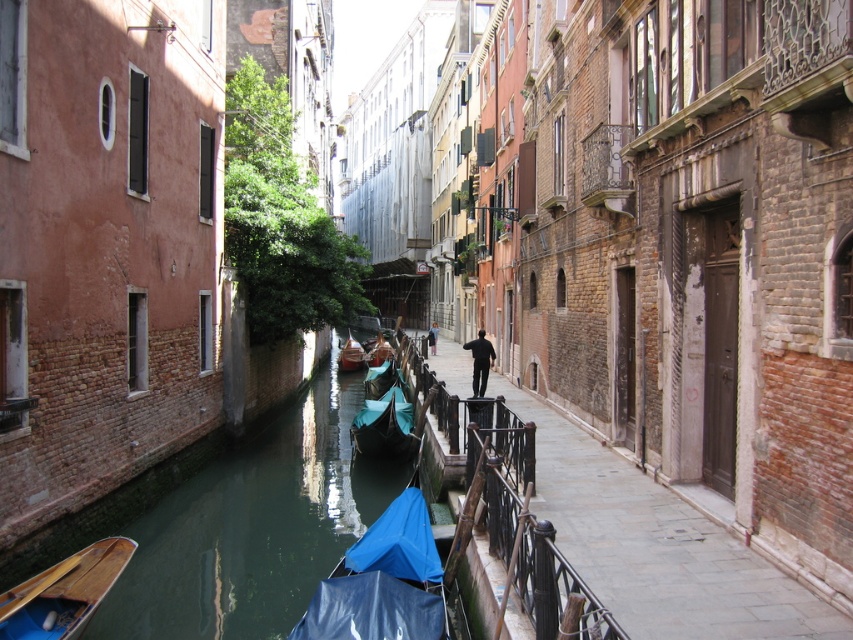
Can you confirm if blue tarpaulin boat at lower center is positioned to the right of teal fabric gondola at center?

Indeed, blue tarpaulin boat at lower center is positioned on the right side of teal fabric gondola at center.

Is blue tarpaulin boat at lower center in front of teal fabric gondola at center?

That is True.

Is point (409, 624) closer to viewer compared to point (352, 344)?

Yes, point (409, 624) is in front of point (352, 344).

Where is `blue tarpaulin boat at lower center`? blue tarpaulin boat at lower center is located at coordinates (383, 580).

Is green water at canal left below dark blue fabric at center?

Indeed, green water at canal left is positioned under dark blue fabric at center.

Between green water at canal left and dark blue fabric at center, which one is positioned lower?

green water at canal left is lower down.

Does point (223, 490) come farther from viewer compared to point (436, 330)?

No, it is not.

Find the location of a particular element. green water at canal left is located at coordinates (253, 528).

Is point (315, 564) positioned before point (426, 372)?

Yes.

I want to click on green water at canal left, so [x=253, y=528].